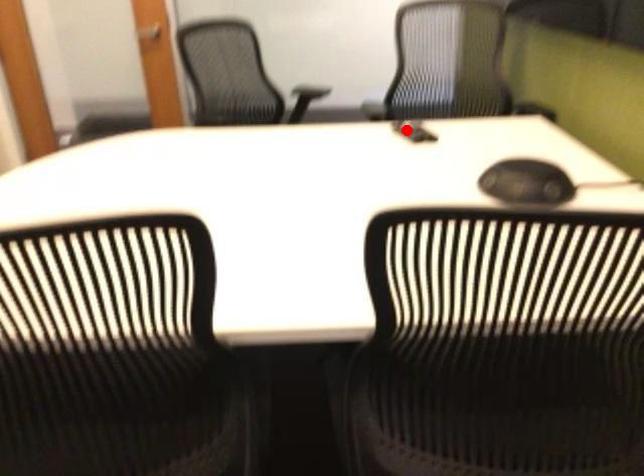
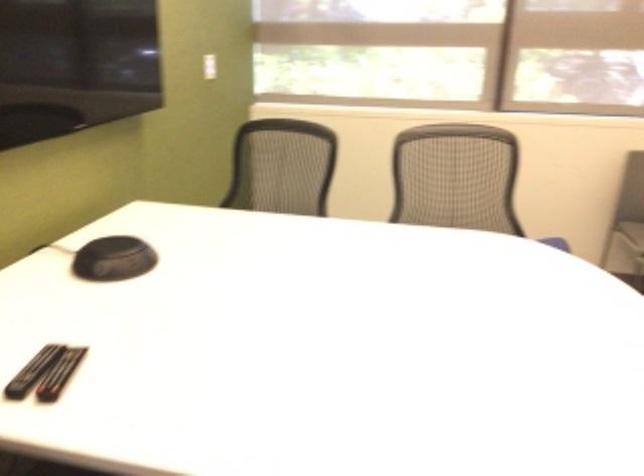
The point at the highlighted location is marked in the first image. Where is the corresponding point in the second image?

(59, 374)